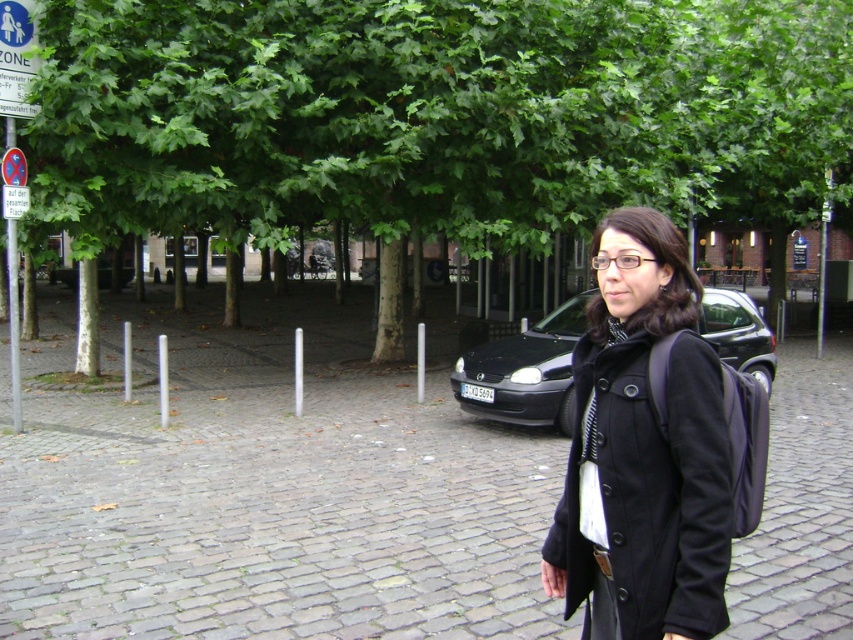
Question: Which point is farther to the camera?

Choices:
 (A) (16, 424)
 (B) (120, 609)
 (C) (560, 360)
 (D) (132, 128)

Answer: (D)

Question: From the image, what is the correct spatial relationship of green leafy tree at center in relation to gray cobblestone pavement at center?

Choices:
 (A) left
 (B) right

Answer: (B)

Question: Which point is farther to the camera?

Choices:
 (A) (645, 384)
 (B) (416, 412)

Answer: (B)

Question: Is gray cobblestone pavement at center below black matte coat at center?

Choices:
 (A) no
 (B) yes

Answer: (B)

Question: Which point is closer to the camera?

Choices:
 (A) gray cobblestone pavement at center
 (B) metallic pole at left
 (C) black matte coat at center
 (D) green leafy tree at center

Answer: (C)

Question: Can you confirm if green leafy tree at center is positioned below black matte coat at center?

Choices:
 (A) no
 (B) yes

Answer: (A)